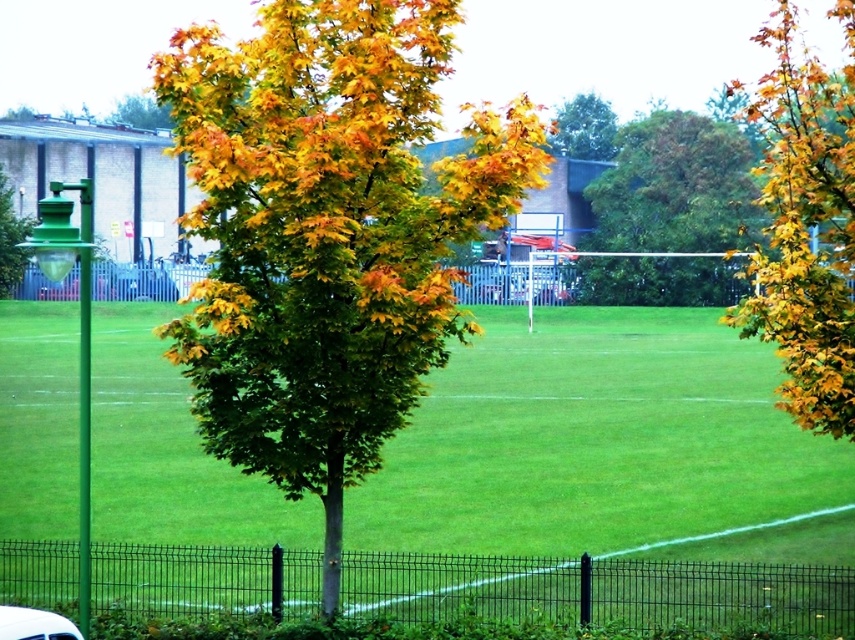
Question: Which of the following is the closest to the observer?

Choices:
 (A) (163, 112)
 (B) (16, 618)
 (C) (765, 291)
 (D) (337, 115)

Answer: (B)

Question: Does golden-green foliage at center come behind green matte tree at left?

Choices:
 (A) yes
 (B) no

Answer: (B)

Question: Can you confirm if golden yellow leaves at upper right is thinner than green matte tree at left?

Choices:
 (A) yes
 (B) no

Answer: (B)

Question: Where is green leafy tree at upper center located in relation to white matte car at lower left in the image?

Choices:
 (A) right
 (B) left

Answer: (A)

Question: Estimate the real-world distances between objects in this image. Which object is farther from the white matte car at lower left?

Choices:
 (A) golden-green foliage at center
 (B) green grass at center
 (C) golden yellow leaves at upper right

Answer: (B)

Question: Estimate the real-world distances between objects in this image. Which object is closer to the golden yellow leaves at center?

Choices:
 (A) golden yellow leaves at upper center
 (B) golden-green foliage at center
 (C) golden yellow leaves at upper right

Answer: (B)